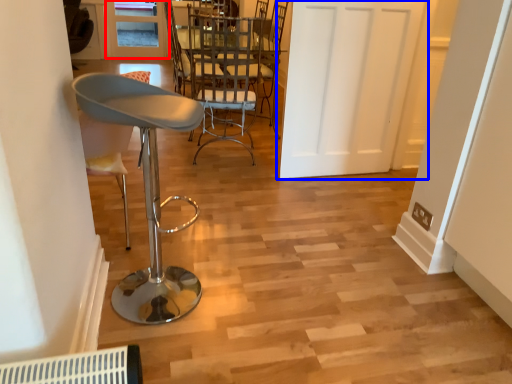
Question: Which object appears closest to the camera in this image, window (highlighted by a red box) or door (highlighted by a blue box)?

Choices:
 (A) window
 (B) door

Answer: (B)